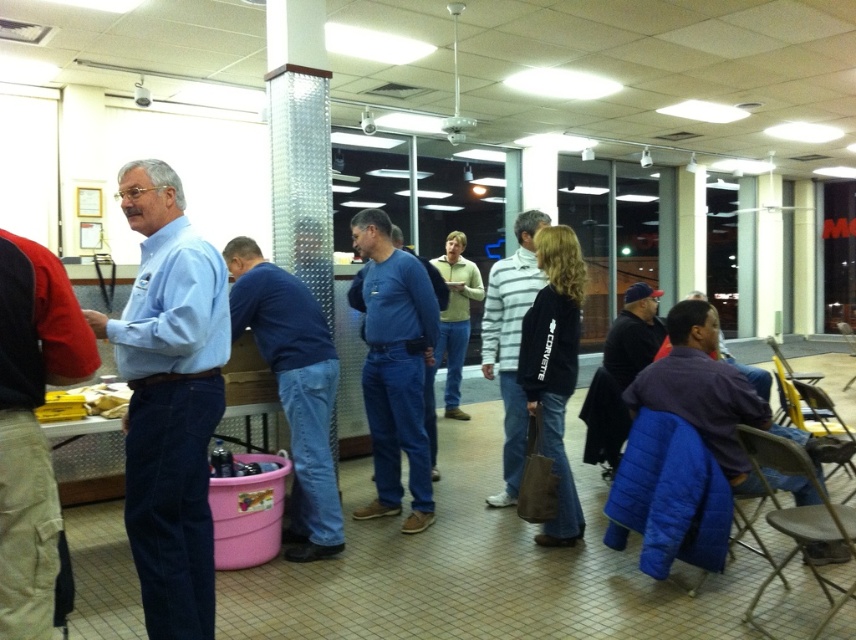
You are standing in the room and want to move from the point at coordinates point (514, 406) to the point at coordinates point (661, 349). Which direction should you move to get closer to the second point?

To move from point (514, 406) to point (661, 349), you should move upwards and to the left since point (661, 349) is further away from the viewer compared to point (514, 406).

You are organizing a photo shoot and need to place a small decorative item on the dark blue cap at center and the purple cotton shirt at lower right. Which object will the item fit better on?

The dark blue cap at center is larger in size than the purple cotton shirt at lower right, so the item will fit better on the dark blue cap at center.